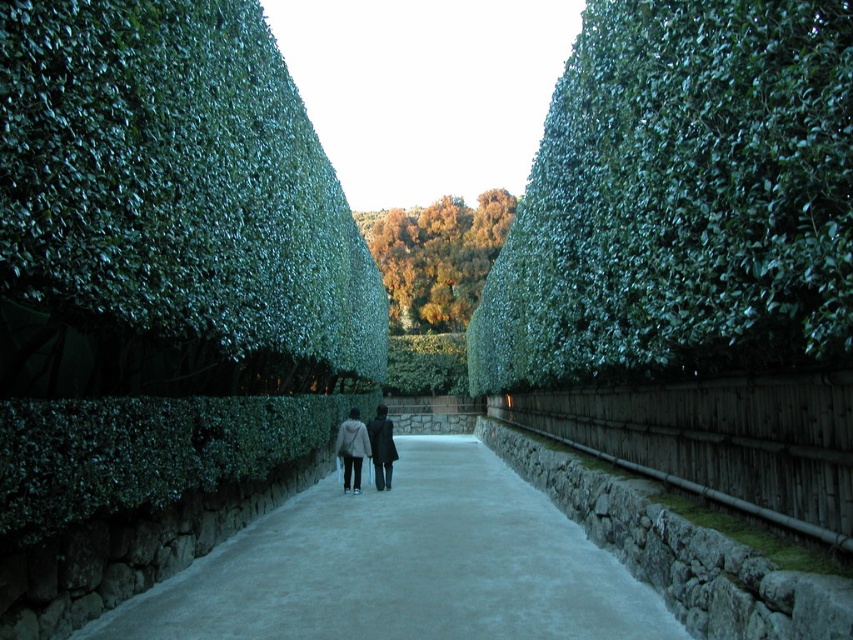
Which of these two, golden textured foliage at center or dark gray coat at center, stands taller?

golden textured foliage at center is taller.

Does golden textured foliage at center lie in front of dark gray coat at center?

No, it is not.

Who is more forward, (409, 240) or (363, 426)?

Point (363, 426) is in front.

This screenshot has width=853, height=640. In order to click on golden textured foliage at center in this screenshot , I will do click(x=437, y=257).

Who is shorter, green leafy hedge at center or golden textured foliage at center?

With less height is green leafy hedge at center.

Is the position of green leafy hedge at center less distant than that of golden textured foliage at center?

Yes.

You are a GUI agent. You are given a task and a screenshot of the screen. Output one action in this format:
    pyautogui.click(x=<x>, y=<y>)
    Task: Click on the green leafy hedge at center
    The width and height of the screenshot is (853, 640).
    Given the screenshot: What is the action you would take?
    pyautogui.click(x=682, y=198)

Locate an element on the screen. The image size is (853, 640). green leafy hedge at center is located at coordinates (x=682, y=198).

Can you confirm if green leafy hedge at center is positioned to the right of dark gray coat at center?

Correct, you'll find green leafy hedge at center to the right of dark gray coat at center.

Describe the element at coordinates (682, 198) in the screenshot. This screenshot has height=640, width=853. I see `green leafy hedge at center` at that location.

This screenshot has width=853, height=640. I want to click on green leafy hedge at center, so click(682, 198).